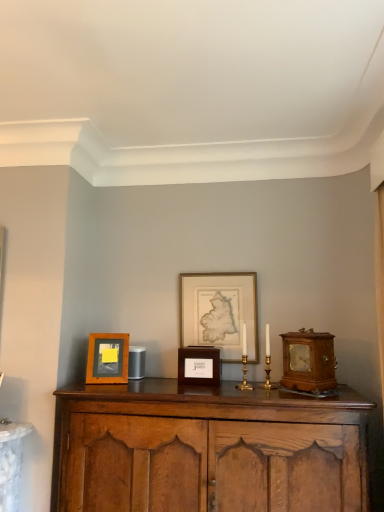
Question: Which direction should I rotate to look at gold-framed map at center, which is the first picture frame from right to left?

Choices:
 (A) right
 (B) left

Answer: (A)

Question: From a real-world perspective, is wooden frame at left, placed as the third picture frame when sorted from right to left, under gold-framed map at center, which is the first picture frame from right to left?

Choices:
 (A) yes
 (B) no

Answer: (A)

Question: Does wooden frame at left, placed as the third picture frame when sorted from right to left, have a smaller size compared to gold-framed map at center, the third picture frame when ordered from left to right?

Choices:
 (A) no
 (B) yes

Answer: (B)

Question: Does wooden frame at left, placed as the third picture frame when sorted from right to left, appear on the right side of gold-framed map at center, the third picture frame when ordered from left to right?

Choices:
 (A) yes
 (B) no

Answer: (B)

Question: From a real-world perspective, is wooden frame at left, placed as the third picture frame when sorted from right to left, located higher than gold-framed map at center, which is the first picture frame from right to left?

Choices:
 (A) yes
 (B) no

Answer: (B)

Question: Is wooden frame at left, the 1th picture frame positioned from the left, positioned before gold-framed map at center, the third picture frame when ordered from left to right?

Choices:
 (A) yes
 (B) no

Answer: (A)

Question: Is wooden frame at left, the 1th picture frame positioned from the left, located outside gold-framed map at center, which is the first picture frame from right to left?

Choices:
 (A) no
 (B) yes

Answer: (B)

Question: From the image's perspective, is wooden frame at left, the 1th picture frame positioned from the left, on top of wooden cabinet at center?

Choices:
 (A) yes
 (B) no

Answer: (A)

Question: Can you see wooden frame at left, the 1th picture frame positioned from the left, touching wooden cabinet at center?

Choices:
 (A) yes
 (B) no

Answer: (B)

Question: From the image's perspective, is wooden frame at left, placed as the third picture frame when sorted from right to left, under wooden cabinet at center?

Choices:
 (A) no
 (B) yes

Answer: (A)

Question: Is wooden frame at left, placed as the third picture frame when sorted from right to left, to the left of wooden cabinet at center from the viewer's perspective?

Choices:
 (A) yes
 (B) no

Answer: (A)

Question: Does wooden frame at left, placed as the third picture frame when sorted from right to left, have a lesser width compared to wooden cabinet at center?

Choices:
 (A) no
 (B) yes

Answer: (B)

Question: Is wooden frame at left, placed as the third picture frame when sorted from right to left, outside wooden cabinet at center?

Choices:
 (A) no
 (B) yes

Answer: (B)

Question: Is wooden cabinet at center to the left of gold-framed map at center, the third picture frame when ordered from left to right, from the viewer's perspective?

Choices:
 (A) no
 (B) yes

Answer: (B)